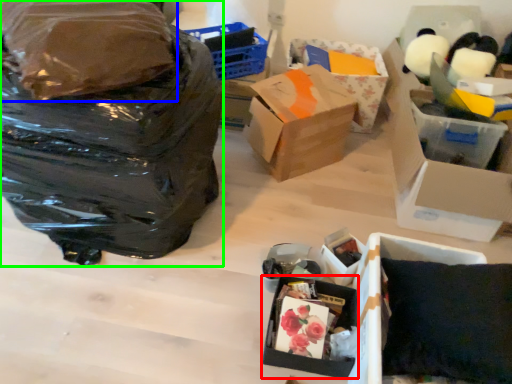
Question: Considering the real-world distances, which object is closest to box (highlighted by a red box)? plastic bag (highlighted by a blue box) or bag (highlighted by a green box).

Choices:
 (A) plastic bag
 (B) bag

Answer: (B)